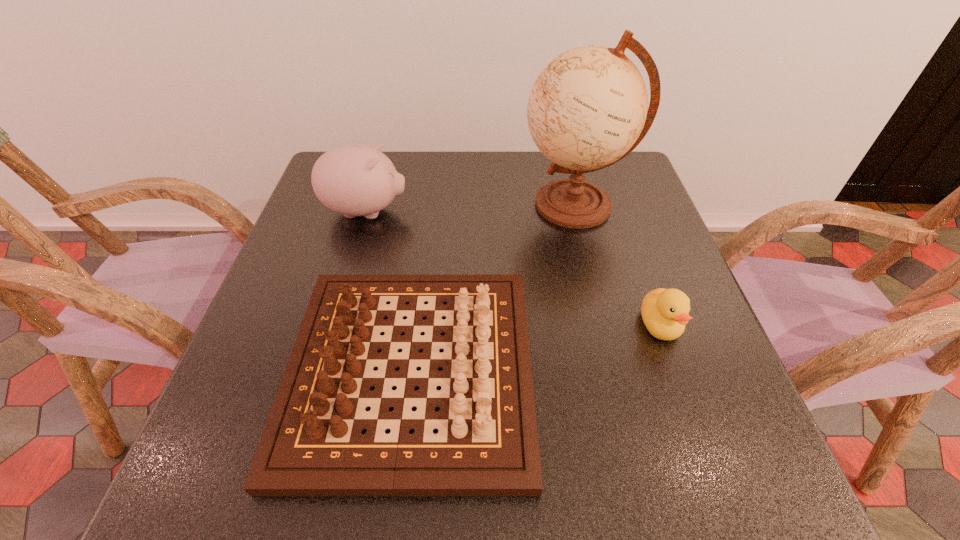
The image size is (960, 540). What are the coordinates of `globe` in the screenshot? It's located at (588, 108).

This screenshot has height=540, width=960. Find the location of `piggy bank`. piggy bank is located at coordinates (354, 180).

Identify the location of duckling. The height and width of the screenshot is (540, 960). (664, 312).

Find the location of a particular element. This screenshot has height=540, width=960. gameboard is located at coordinates (487, 446).

The image size is (960, 540). In order to click on free space located on the surface of the tallest object in this screenshot , I will do `click(481, 205)`.

Locate an element on the screen. Image resolution: width=960 pixels, height=540 pixels. vacant space situated on the surface of the tallest object is located at coordinates (369, 205).

I want to click on vacant region located on the surface of the tallest object, so click(x=372, y=205).

What are the coordinates of `free point located 0.230m at the snout of the piggy bank` in the screenshot? It's located at (500, 212).

You are a GUI agent. You are given a task and a screenshot of the screen. Output one action in this format:
    pyautogui.click(x=<x>, y=<y>)
    Task: Click on the vacant space located on the face of the duckling
    This screenshot has height=540, width=960.
    Given the screenshot: What is the action you would take?
    pyautogui.click(x=697, y=430)

The height and width of the screenshot is (540, 960). I want to click on vacant area located 0.240m on the side with the white pieces of the gameboard, so click(x=663, y=372).